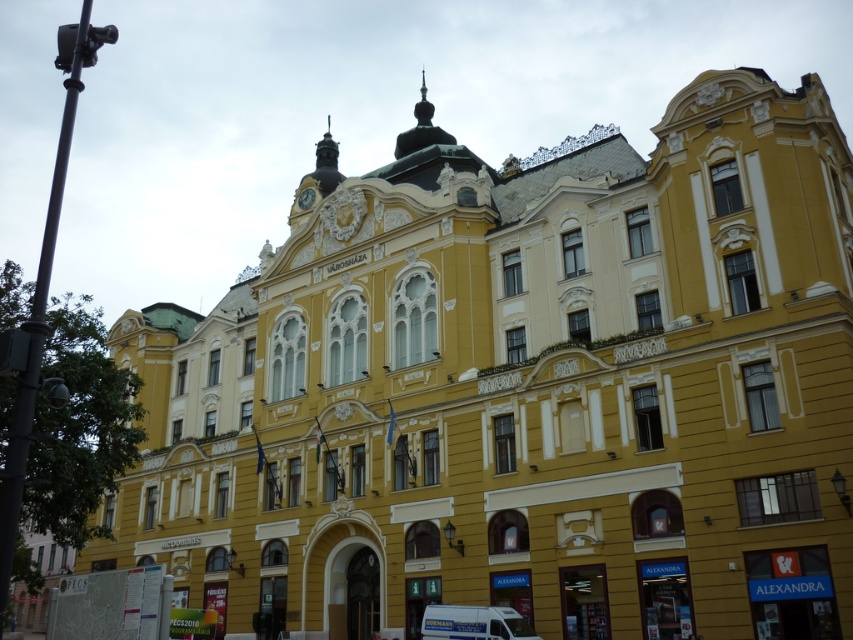
You are a photographer trying to capture the entire gold metallic clock at upper center and the white matte van at lower center in a single shot. Based on their heights, which object will appear smaller in the photo?

The white matte van at lower center will appear smaller in the photo because it has a lesser height compared to the gold metallic clock at upper center.

You are a photographer planning to capture the grand building with both the white matte van at lower center and the gold metallic clock at upper center in the frame. Which object will appear wider in the photograph?

The gold metallic clock at upper center will appear wider in the photograph since its width is greater than that of the white matte van at lower center.